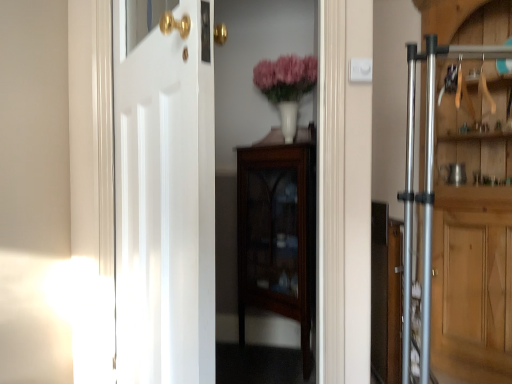
Question: From the image's perspective, does pink matte vase at upper center appear higher than mahogany glass-front cabinet at center?

Choices:
 (A) no
 (B) yes

Answer: (B)

Question: Considering the relative sizes of pink matte vase at upper center and mahogany glass-front cabinet at center in the image provided, is pink matte vase at upper center bigger than mahogany glass-front cabinet at center?

Choices:
 (A) yes
 (B) no

Answer: (B)

Question: From a real-world perspective, is pink matte vase at upper center beneath mahogany glass-front cabinet at center?

Choices:
 (A) yes
 (B) no

Answer: (B)

Question: Is mahogany glass-front cabinet at center a part of pink matte vase at upper center?

Choices:
 (A) yes
 (B) no

Answer: (B)

Question: Is pink matte vase at upper center outside of mahogany glass-front cabinet at center?

Choices:
 (A) no
 (B) yes

Answer: (B)

Question: From a real-world perspective, is mahogany glass-front cabinet at center above or below silver metallic door at right, the 2th door in the front-to-back sequence?

Choices:
 (A) below
 (B) above

Answer: (A)

Question: Is mahogany glass-front cabinet at center taller or shorter than silver metallic door at right, the 2th door in the front-to-back sequence?

Choices:
 (A) short
 (B) tall

Answer: (A)

Question: Considering the positions of mahogany glass-front cabinet at center and silver metallic door at right, which is the 1th door from back to front, in the image, is mahogany glass-front cabinet at center wider or thinner than silver metallic door at right, which is the 1th door from back to front,?

Choices:
 (A) thin
 (B) wide

Answer: (B)

Question: From the image's perspective, relative to silver metallic door at right, the second door viewed from the left, is mahogany glass-front cabinet at center above or below?

Choices:
 (A) below
 (B) above

Answer: (A)

Question: From a real-world perspective, is silver metallic door at right, the 1th door viewed from the right, positioned above or below mahogany glass-front cabinet at center?

Choices:
 (A) above
 (B) below

Answer: (A)

Question: Considering the positions of point (472, 329) and point (270, 218), is point (472, 329) closer or farther from the camera than point (270, 218)?

Choices:
 (A) farther
 (B) closer

Answer: (B)

Question: In terms of width, does silver metallic door at right, which is the 1th door from back to front, look wider or thinner when compared to mahogany glass-front cabinet at center?

Choices:
 (A) thin
 (B) wide

Answer: (A)

Question: Is silver metallic door at right, which is the 1th door from back to front, bigger or smaller than mahogany glass-front cabinet at center?

Choices:
 (A) big
 (B) small

Answer: (A)

Question: In terms of width, does mahogany glass-front cabinet at center look wider or thinner when compared to pink matte vase at upper center?

Choices:
 (A) wide
 (B) thin

Answer: (A)

Question: In the image, is mahogany glass-front cabinet at center on the left side or the right side of pink matte vase at upper center?

Choices:
 (A) left
 (B) right

Answer: (A)